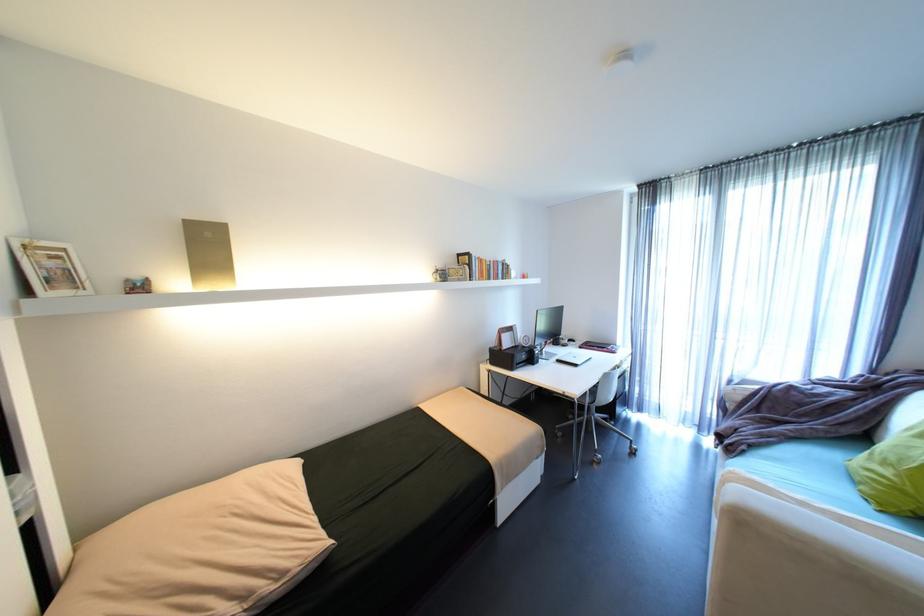
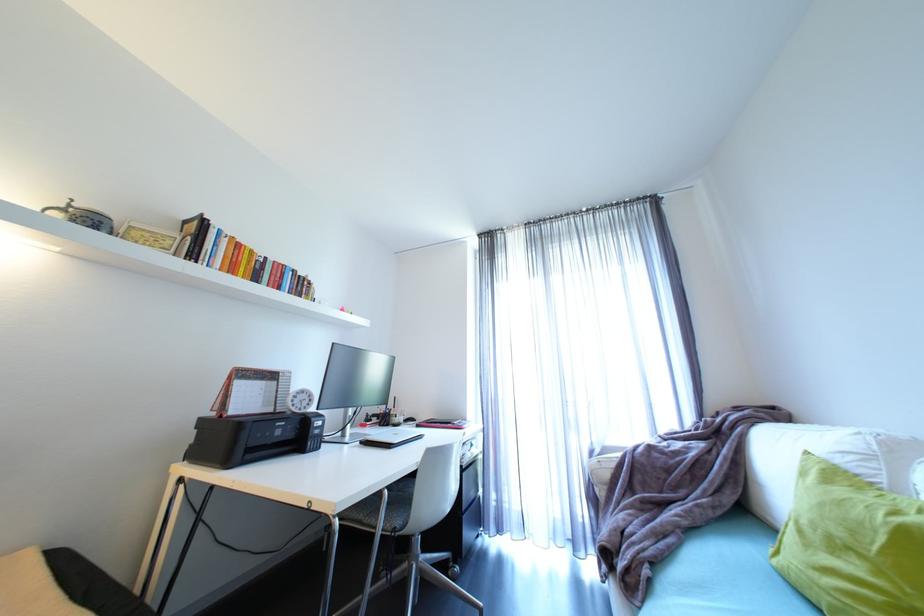
Locate, in the second image, the point that corresponds to (x=507, y=350) in the first image.

(228, 416)